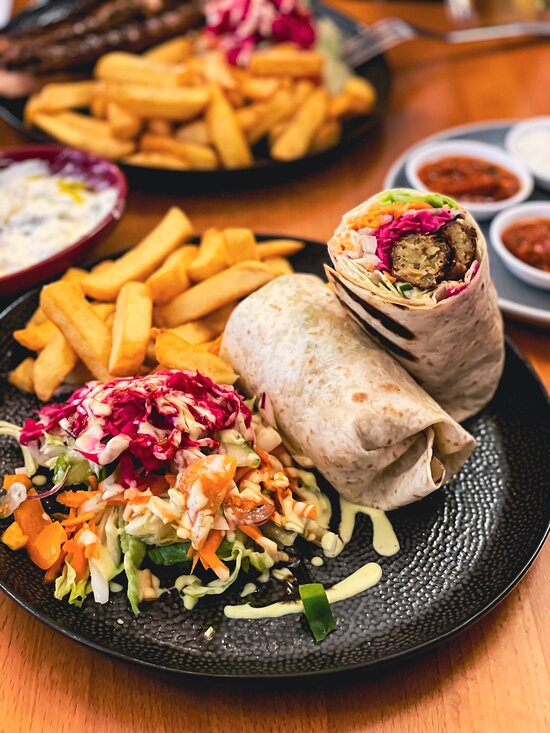
Find the location of a particular element. Image resolution: width=550 pixels, height=733 pixels. fork is located at coordinates (408, 34).